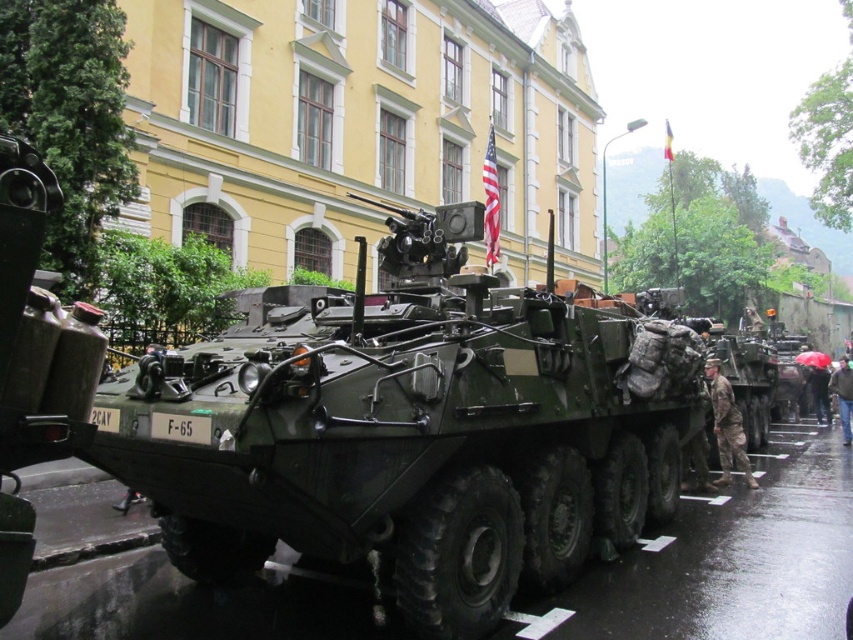
Image resolution: width=853 pixels, height=640 pixels. Describe the element at coordinates (35, 358) in the screenshot. I see `matte green tank at center` at that location.

Can you confirm if matte green tank at center is positioned to the right of camouflage fabric soldier at lower right?

In fact, matte green tank at center is to the left of camouflage fabric soldier at lower right.

Is point (97, 344) positioned behind point (840, 396)?

That is False.

This screenshot has width=853, height=640. What are the coordinates of `matte green tank at center` in the screenshot? It's located at (35, 358).

Consider the image. Is matte green armored vehicle at center to the left of camouflage fabric uniform at center from the viewer's perspective?

Yes, matte green armored vehicle at center is to the left of camouflage fabric uniform at center.

In the scene shown: Who is more distant from viewer, (432, 272) or (712, 401)?

The point (712, 401) is behind.

Describe the element at coordinates (415, 429) in the screenshot. I see `matte green armored vehicle at center` at that location.

Locate an element on the screen. Image resolution: width=853 pixels, height=640 pixels. matte green armored vehicle at center is located at coordinates (415, 429).

Which is below, camouflage fabric uniform at center or camouflage fabric soldier at lower right?

camouflage fabric soldier at lower right is below.

Is camouflage fabric uniform at center wider than camouflage fabric soldier at lower right?

In fact, camouflage fabric uniform at center might be narrower than camouflage fabric soldier at lower right.

Which is in front, point (712, 365) or point (839, 403)?

Point (712, 365) is more forward.

Identify the location of camouflage fabric uniform at center. (727, 426).